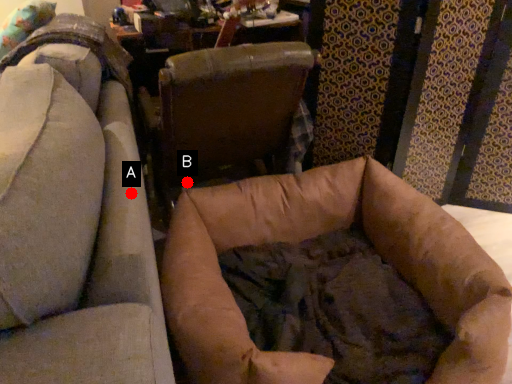
Question: Two points are circled on the image, labeled by A and B beside each circle. Which point is further to the camera?

Choices:
 (A) A is further
 (B) B is further

Answer: (B)